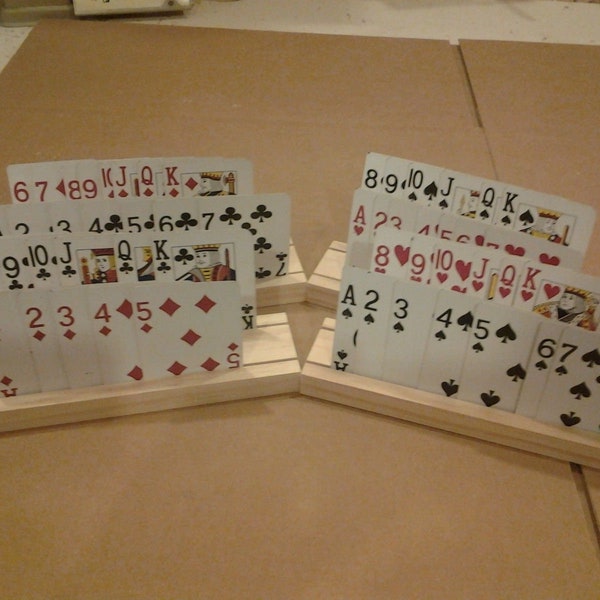
Locate an element on the screen. The image size is (600, 600). floor tiles is located at coordinates (9, 35), (389, 20), (523, 28).